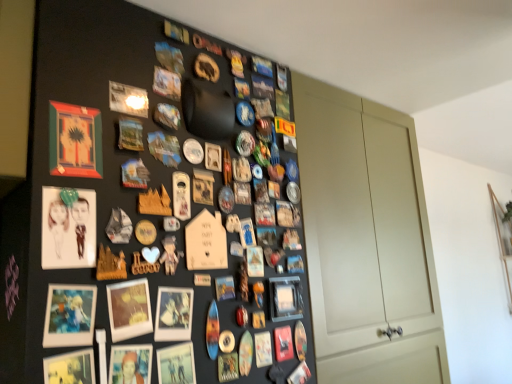
Question: Is matte black picture frame at lower right, positioned as the 8th picture frame in left-to-right order, taller than matte wooden picture frame at upper left, arranged as the eighth picture frame when viewed from the right?

Choices:
 (A) yes
 (B) no

Answer: (B)

Question: Is matte black picture frame at lower right, positioned as the 8th picture frame in left-to-right order, positioned with its back to matte wooden picture frame at upper left, arranged as the eighth picture frame when viewed from the right?

Choices:
 (A) yes
 (B) no

Answer: (B)

Question: Is matte black picture frame at lower right, positioned as the 8th picture frame in left-to-right order, far away from matte wooden picture frame at upper left, arranged as the eighth picture frame when viewed from the right?

Choices:
 (A) yes
 (B) no

Answer: (B)

Question: Can you confirm if matte black picture frame at lower right, positioned as the 8th picture frame in left-to-right order, is bigger than matte wooden picture frame at upper left, arranged as the first picture frame when viewed from the left?

Choices:
 (A) yes
 (B) no

Answer: (A)

Question: Is the position of matte black picture frame at lower right, the first picture frame in the right-to-left sequence, more distant than that of matte wooden picture frame at upper left, arranged as the eighth picture frame when viewed from the right?

Choices:
 (A) no
 (B) yes

Answer: (B)

Question: Considering the positions of point (167, 314) and point (81, 336), is point (167, 314) closer or farther from the camera than point (81, 336)?

Choices:
 (A) farther
 (B) closer

Answer: (A)

Question: Looking at their shapes, would you say matte white photo frame at center, the seventh picture frame from the left, is wider or thinner than matte plastic picture frame at lower left, the 3th picture frame positioned from the left?

Choices:
 (A) wide
 (B) thin

Answer: (A)

Question: Is matte white photo frame at center, the second picture frame viewed from the right, taller or shorter than matte plastic picture frame at lower left, which appears as the 6th picture frame when viewed from the right?

Choices:
 (A) tall
 (B) short

Answer: (A)

Question: Looking at the image, does matte white photo frame at center, the second picture frame viewed from the right, seem bigger or smaller compared to matte plastic picture frame at lower left, the 3th picture frame positioned from the left?

Choices:
 (A) small
 (B) big

Answer: (B)

Question: Is matte plastic picture frame at lower left, the 3th picture frame positioned from the left, to the left or to the right of matte wooden picture frame at center, the fourth picture frame in the right-to-left sequence, in the image?

Choices:
 (A) left
 (B) right

Answer: (A)

Question: Considering the positions of matte plastic picture frame at lower left, the 3th picture frame positioned from the left, and matte wooden picture frame at center, marked as the 5th picture frame in a left-to-right arrangement, in the image, is matte plastic picture frame at lower left, the 3th picture frame positioned from the left, wider or thinner than matte wooden picture frame at center, marked as the 5th picture frame in a left-to-right arrangement,?

Choices:
 (A) wide
 (B) thin

Answer: (B)

Question: From a real-world perspective, is matte plastic picture frame at lower left, the 3th picture frame positioned from the left, positioned above or below matte wooden picture frame at center, the fourth picture frame in the right-to-left sequence?

Choices:
 (A) below
 (B) above

Answer: (A)

Question: Relative to matte wooden picture frame at center, the fourth picture frame in the right-to-left sequence, is matte plastic picture frame at lower left, the 3th picture frame positioned from the left, in front or behind?

Choices:
 (A) front
 (B) behind

Answer: (A)

Question: Looking at their shapes, would you say matte wooden picture frame at upper left, arranged as the first picture frame when viewed from the left, is wider or thinner than matte wooden picture frame at center, the fourth picture frame in the right-to-left sequence?

Choices:
 (A) thin
 (B) wide

Answer: (A)

Question: Considering the positions of matte wooden picture frame at upper left, arranged as the first picture frame when viewed from the left, and matte wooden picture frame at center, the fourth picture frame in the right-to-left sequence, in the image, is matte wooden picture frame at upper left, arranged as the first picture frame when viewed from the left, bigger or smaller than matte wooden picture frame at center, the fourth picture frame in the right-to-left sequence,?

Choices:
 (A) big
 (B) small

Answer: (B)